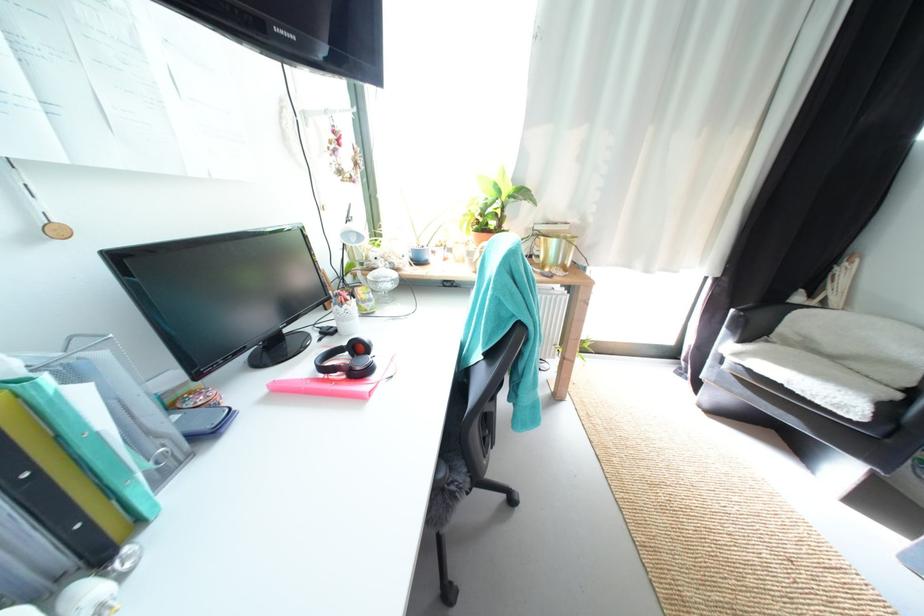
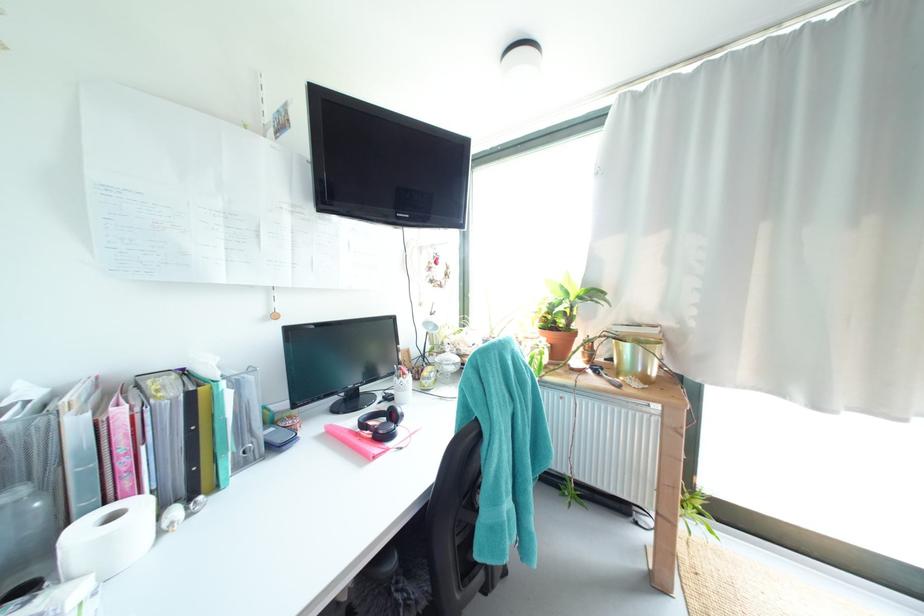
In the second image, find the point that corresponds to point 348,306 in the first image.

(407, 379)